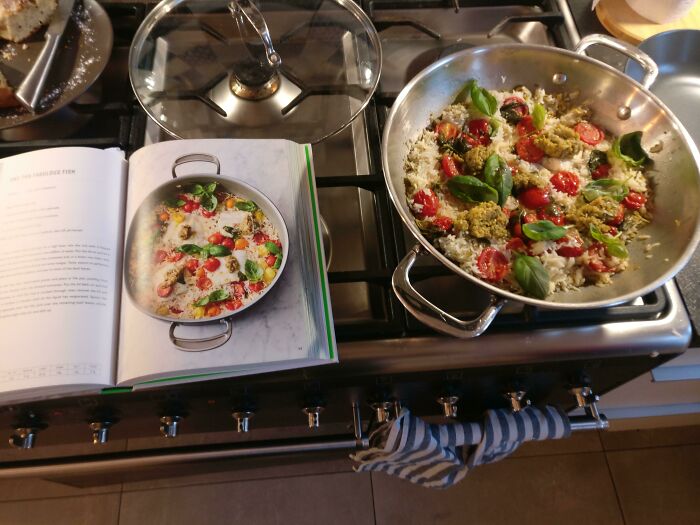
Where is `photo of pan handle`? This screenshot has width=700, height=525. photo of pan handle is located at coordinates (188, 156), (192, 346).